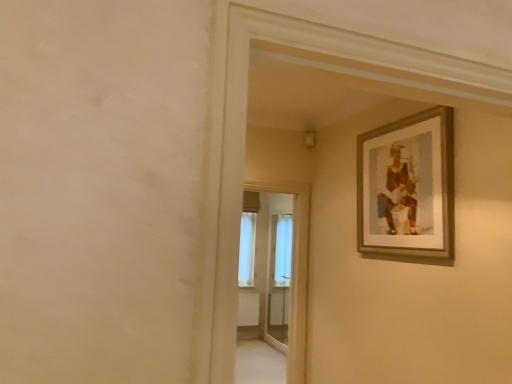
What do you see at coordinates (407, 186) in the screenshot?
I see `wooden framed artwork at upper right` at bounding box center [407, 186].

Image resolution: width=512 pixels, height=384 pixels. In order to click on wooden framed artwork at upper right in this screenshot , I will do point(407,186).

You are a GUI agent. You are given a task and a screenshot of the screen. Output one action in this format:
    pyautogui.click(x=<x>, y=<y>)
    Task: Click on the wooden framed artwork at upper right
    The image size is (512, 384).
    Given the screenshot: What is the action you would take?
    pyautogui.click(x=407, y=186)